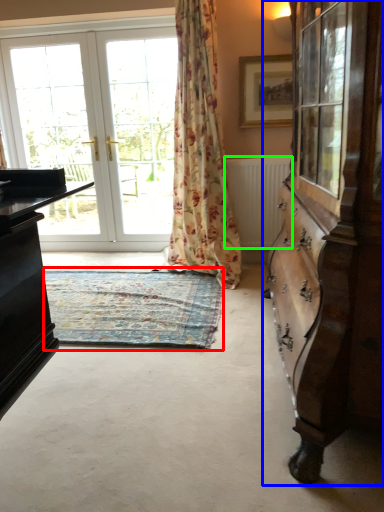
Question: Which is nearer to the mat (highlighted by a red box)? cabinetry (highlighted by a blue box) or radiator (highlighted by a green box).

Choices:
 (A) cabinetry
 (B) radiator

Answer: (B)